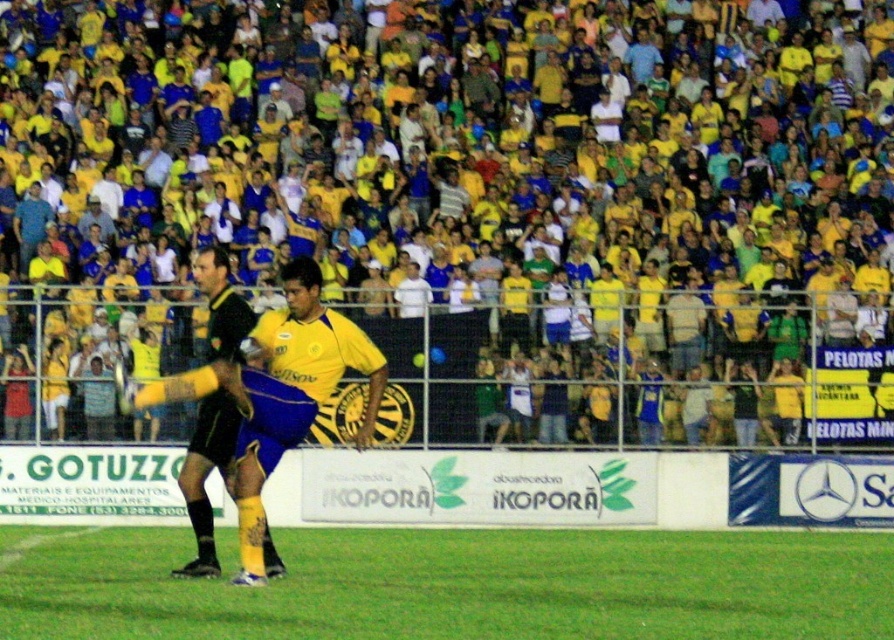
Question: Among these objects, which one is nearest to the camera?

Choices:
 (A) green grass at lower center
 (B) yellow/yellowish fabric at upper center
 (C) yellow matte jersey at center

Answer: (A)

Question: Which of the following is the farthest from the observer?

Choices:
 (A) (308, 269)
 (B) (201, 504)
 (C) (111, 401)

Answer: (C)

Question: Can you confirm if green grass at lower center is positioned below yellow matte jersey at center?

Choices:
 (A) yes
 (B) no

Answer: (A)

Question: Is yellow/yellowish fabric at upper center above green grass at lower center?

Choices:
 (A) no
 (B) yes

Answer: (B)

Question: Which object is farther from the camera taking this photo?

Choices:
 (A) yellow matte jersey at center
 (B) yellow/yellowish fabric at upper center

Answer: (B)

Question: Is yellow matte jersey at center closer to the viewer compared to black matte jersey at center?

Choices:
 (A) yes
 (B) no

Answer: (A)